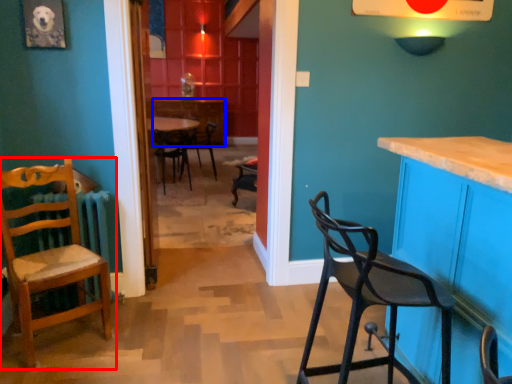
Question: Which object is further to the camera taking this photo, chair (highlighted by a red box) or table (highlighted by a blue box)?

Choices:
 (A) chair
 (B) table

Answer: (B)